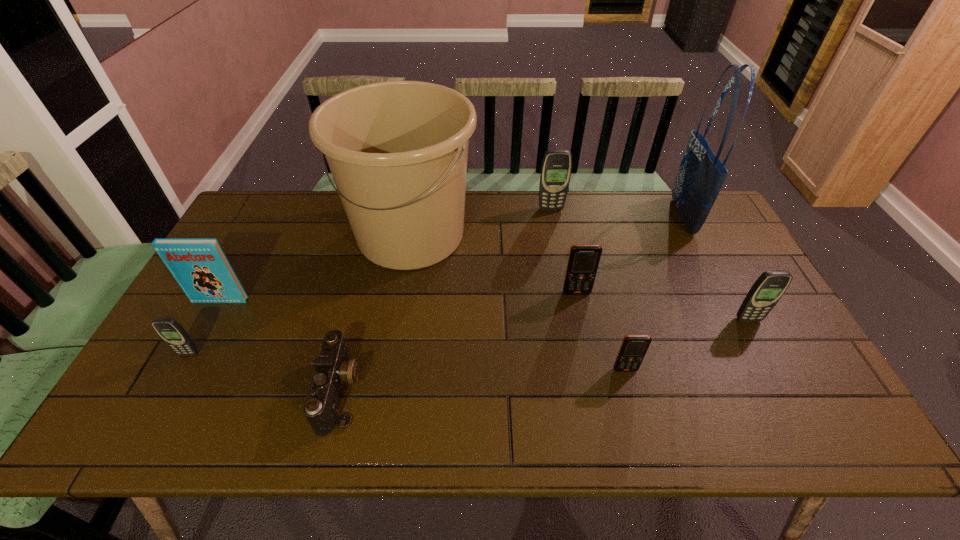
Locate an element on the screen. The height and width of the screenshot is (540, 960). free space located 0.340m on the screen of the tallest cellular telephone is located at coordinates (x=564, y=284).

Where is `blank area located 0.330m on the front cover of the blue book`? Image resolution: width=960 pixels, height=540 pixels. blank area located 0.330m on the front cover of the blue book is located at coordinates (159, 414).

I want to click on free space located 0.200m on the screen of the rightmost cellular telephone, so click(785, 389).

Where is `vacant region located 0.150m on the screen of the second farthest cellular telephone`? The height and width of the screenshot is (540, 960). vacant region located 0.150m on the screen of the second farthest cellular telephone is located at coordinates pyautogui.click(x=586, y=339).

Image resolution: width=960 pixels, height=540 pixels. In order to click on free space located on the screen of the nearest cellular telephone in this screenshot , I will do `click(635, 407)`.

Where is `vacant space located on the screen of the leftmost cellular telephone`? This screenshot has width=960, height=540. vacant space located on the screen of the leftmost cellular telephone is located at coordinates (155, 416).

Find the location of a particular element. The image size is (960, 540). free region located 0.120m on the front-facing side of the camera is located at coordinates (411, 391).

This screenshot has width=960, height=540. Find the location of `shopping bag that is positioned at the far edge`. shopping bag that is positioned at the far edge is located at coordinates (701, 175).

I want to click on bucket that is at the far edge, so coord(397,150).

Where is `cellular telephone that is at the far edge`? This screenshot has width=960, height=540. cellular telephone that is at the far edge is located at coordinates (556, 168).